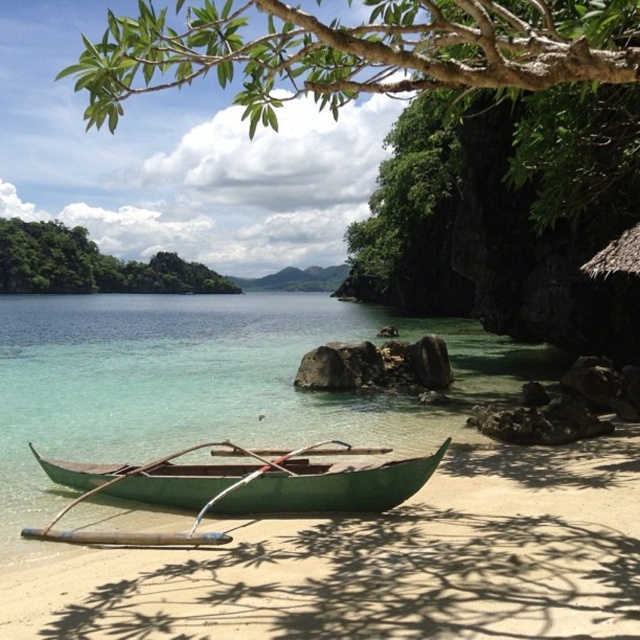
Question: Among these points, which one is farthest from the camera?

Choices:
 (A) (48, 252)
 (B) (552, 362)
 (C) (61, 468)

Answer: (A)

Question: From the image, what is the correct spatial relationship of green sand at lower center in relation to green leafy tree at upper left?

Choices:
 (A) left
 (B) right

Answer: (B)

Question: Does green sand at lower center appear on the right side of clear glass water at center?

Choices:
 (A) no
 (B) yes

Answer: (B)

Question: Which of the following is the farthest from the observer?

Choices:
 (A) clear glass water at center
 (B) green sand at lower center
 (C) green polished wood canoe at center
 (D) green leafy tree at upper left

Answer: (D)

Question: Among these objects, which one is nearest to the camera?

Choices:
 (A) green polished wood canoe at center
 (B) green sand at lower center
 (C) clear glass water at center

Answer: (B)

Question: From the image, what is the correct spatial relationship of green polished wood canoe at center in relation to green leafy tree at upper left?

Choices:
 (A) above
 (B) below

Answer: (B)